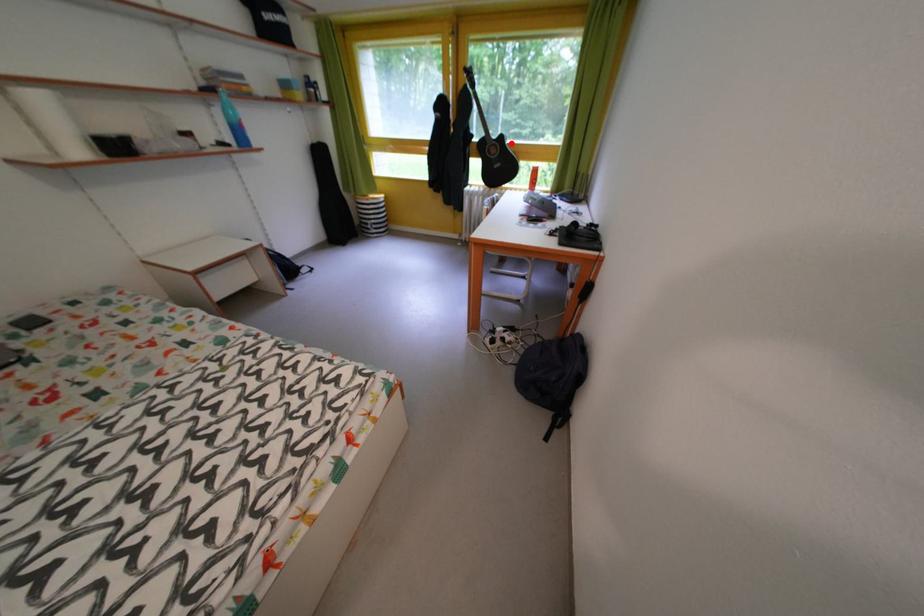
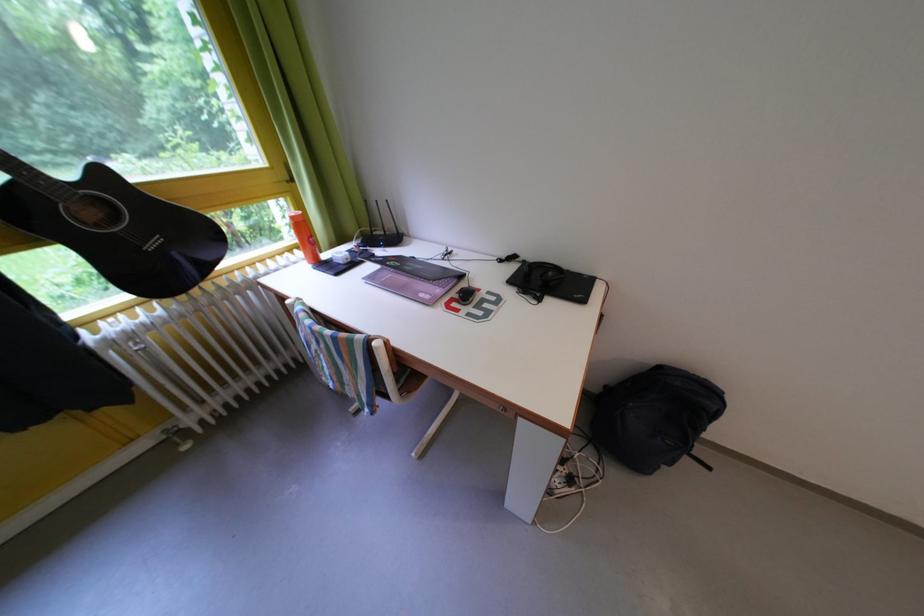
The point at the highlighted location is marked in the first image. Where is the corresponding point in the second image?

(112, 179)